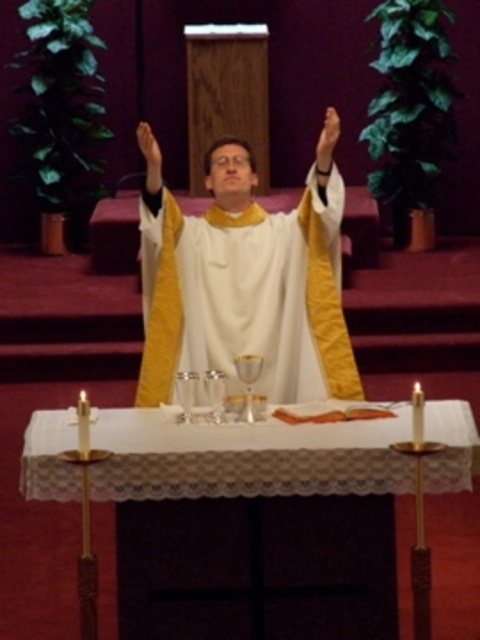
You are an interior designer planning to place a 3D model of the priest in the center of the church scene. Given the white satin robe at center and the white lace tablecloth at center, which object has a greater width?

The white satin robe at center has a greater width than the white lace tablecloth at center according to the description.

You are attending a religious ceremony and notice two white items at the center of the altar area. Which one is taller between the white satin robe at center and the white lace tablecloth at center?

The white satin robe at center is taller than the white lace tablecloth at center.

You are an assistant helping to prepare for a religious ceremony. You need to determine the position of the white satin robe at center relative to the white lace tablecloth at center. Based on the scene, can you tell if the robe is above or below the tablecloth?

The white satin robe at center is above the white lace tablecloth at center, so the robe is positioned over the tablecloth.